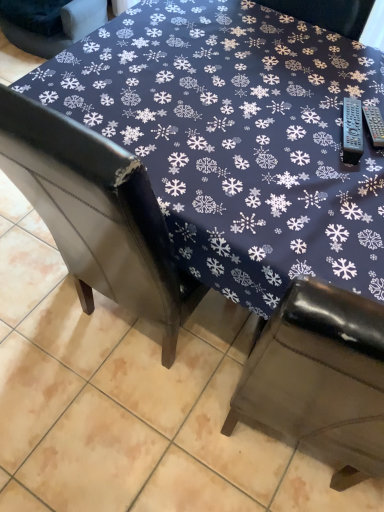
Question: Should I look upward or downward to see dark blue fabric tablecloth at center?

Choices:
 (A) down
 (B) up

Answer: (B)

Question: Are dark blue fabric tablecloth at center and dark leather chair at upper left beside each other?

Choices:
 (A) yes
 (B) no

Answer: (B)

Question: From the image's perspective, is dark blue fabric tablecloth at center below dark leather chair at upper left?

Choices:
 (A) no
 (B) yes

Answer: (B)

Question: Considering the relative positions of dark blue fabric tablecloth at center and dark leather chair at upper left in the image provided, is dark blue fabric tablecloth at center in front of dark leather chair at upper left?

Choices:
 (A) no
 (B) yes

Answer: (B)

Question: Can you confirm if dark blue fabric tablecloth at center is smaller than dark leather chair at upper left?

Choices:
 (A) no
 (B) yes

Answer: (A)

Question: Considering the relative sizes of dark blue fabric tablecloth at center and dark leather chair at upper left in the image provided, is dark blue fabric tablecloth at center thinner than dark leather chair at upper left?

Choices:
 (A) no
 (B) yes

Answer: (A)

Question: From a real-world perspective, does dark blue fabric tablecloth at center stand above dark leather chair at upper left?

Choices:
 (A) no
 (B) yes

Answer: (B)

Question: Does dark leather chair at upper left come behind dark blue fabric tablecloth at center?

Choices:
 (A) yes
 (B) no

Answer: (A)

Question: Considering the relative sizes of dark leather chair at upper left and dark blue fabric tablecloth at center in the image provided, is dark leather chair at upper left smaller than dark blue fabric tablecloth at center?

Choices:
 (A) no
 (B) yes

Answer: (B)

Question: From a real-world perspective, is dark leather chair at upper left located higher than dark blue fabric tablecloth at center?

Choices:
 (A) no
 (B) yes

Answer: (A)

Question: Is dark leather chair at upper left next to dark blue fabric tablecloth at center?

Choices:
 (A) yes
 (B) no

Answer: (B)

Question: Is dark leather chair at upper left aimed at dark blue fabric tablecloth at center?

Choices:
 (A) no
 (B) yes

Answer: (A)

Question: Can you confirm if dark leather chair at upper left is bigger than dark blue fabric tablecloth at center?

Choices:
 (A) no
 (B) yes

Answer: (A)

Question: From a real-world perspective, is dark blue fabric tablecloth at center positioned above or below dark leather chair at upper left?

Choices:
 (A) below
 (B) above

Answer: (B)